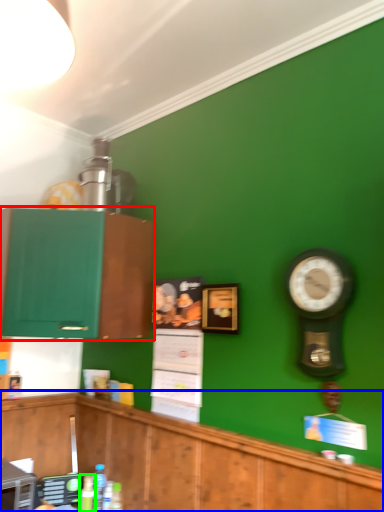
Question: Which is farther away from cabinetry (highlighted by a red box)? cabinetry (highlighted by a blue box) or bottle (highlighted by a green box)?

Choices:
 (A) cabinetry
 (B) bottle

Answer: (B)